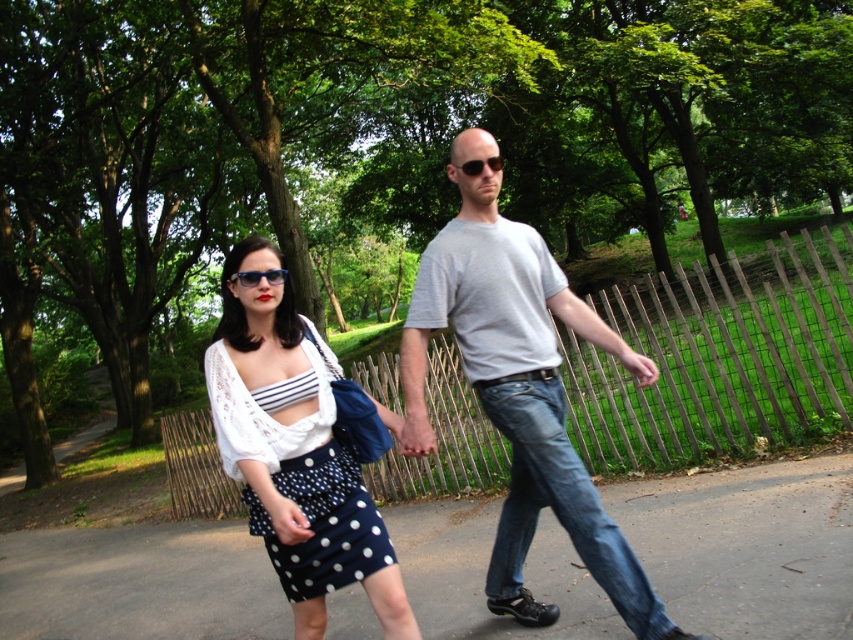
You are standing on the gray asphalt pavement at center and want to walk towards the navy polka dot skirt at center. Which direction should you move?

The gray asphalt pavement at center is to the left of the navy polka dot skirt at center, so you should move to the right to reach it.